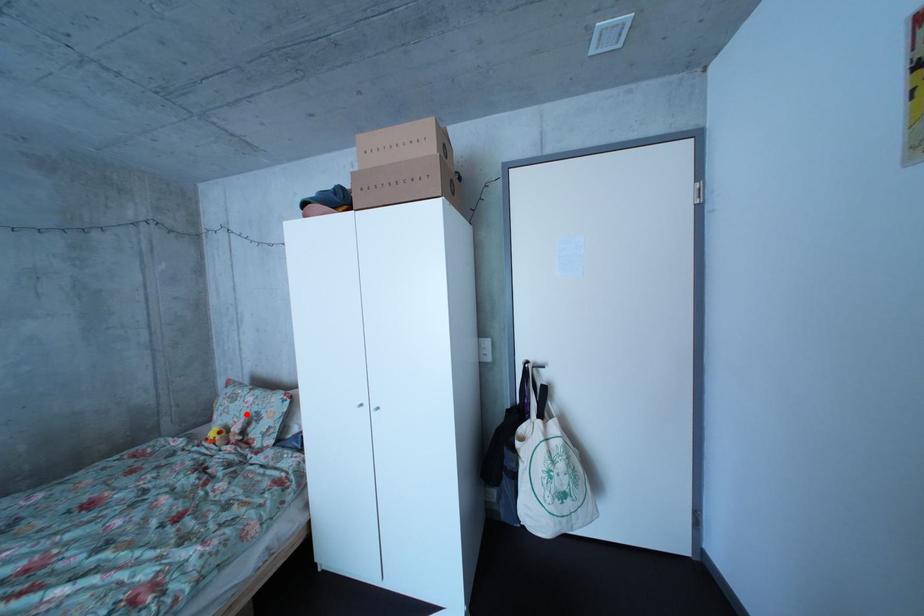
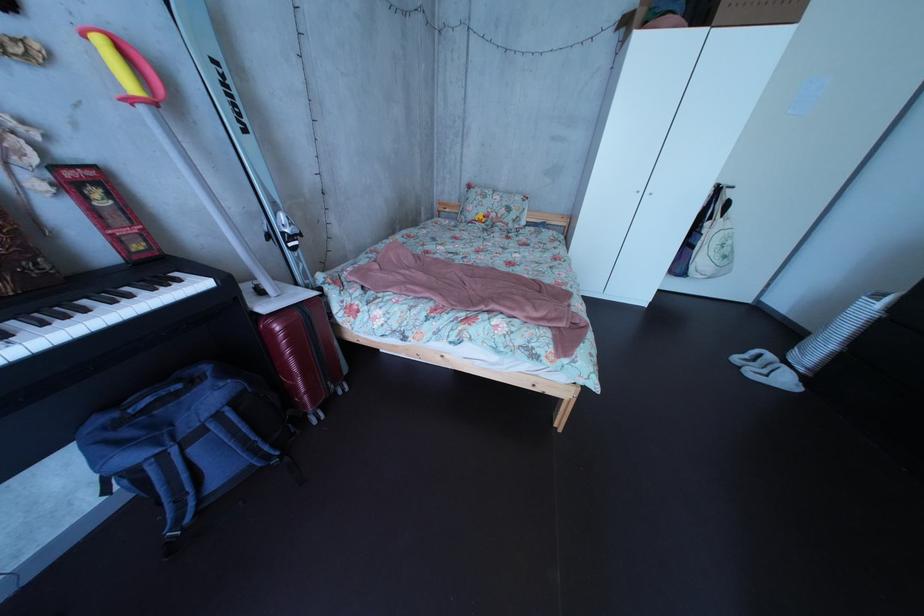
Question: I am providing you with two images of the same scene from different viewpoints. A red point is shown in image1. For the corresponding object point in image2, is it positioned nearer or farther from the camera?

Choices:
 (A) Nearer
 (B) Farther

Answer: (A)